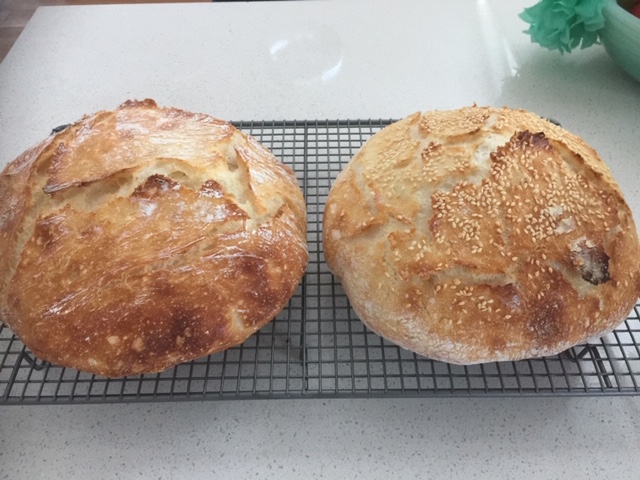
Where is `bowl`? The width and height of the screenshot is (640, 480). bowl is located at coordinates (619, 58).